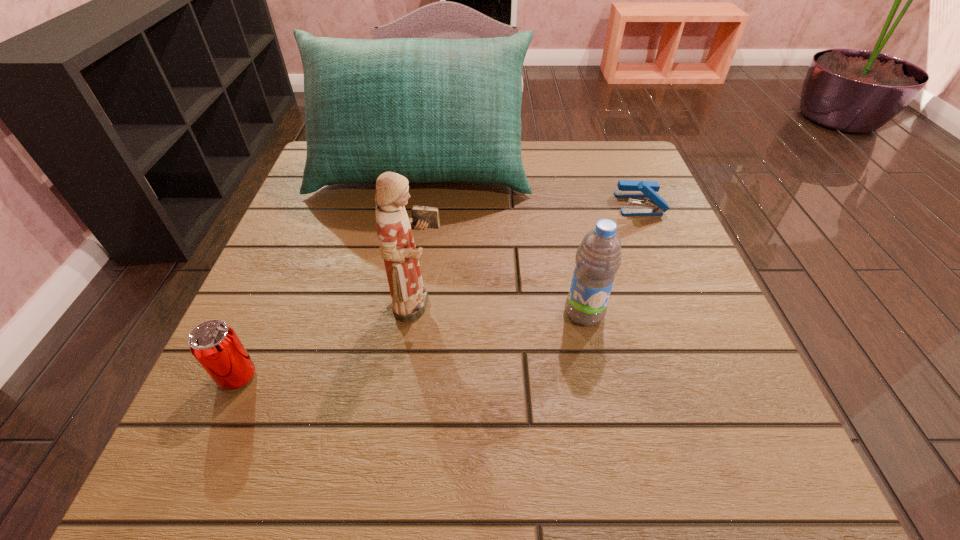
Find the location of `vacant space that satisfies the following two spatial constraints: 1. on the back side of the soda can; 2. on the right side of the fourth object from left to right`. vacant space that satisfies the following two spatial constraints: 1. on the back side of the soda can; 2. on the right side of the fourth object from left to right is located at coordinates (266, 313).

Identify the location of free space that satisfies the following two spatial constraints: 1. on the front-facing side of the figurine; 2. on the front side of the soda can. The width and height of the screenshot is (960, 540). (411, 376).